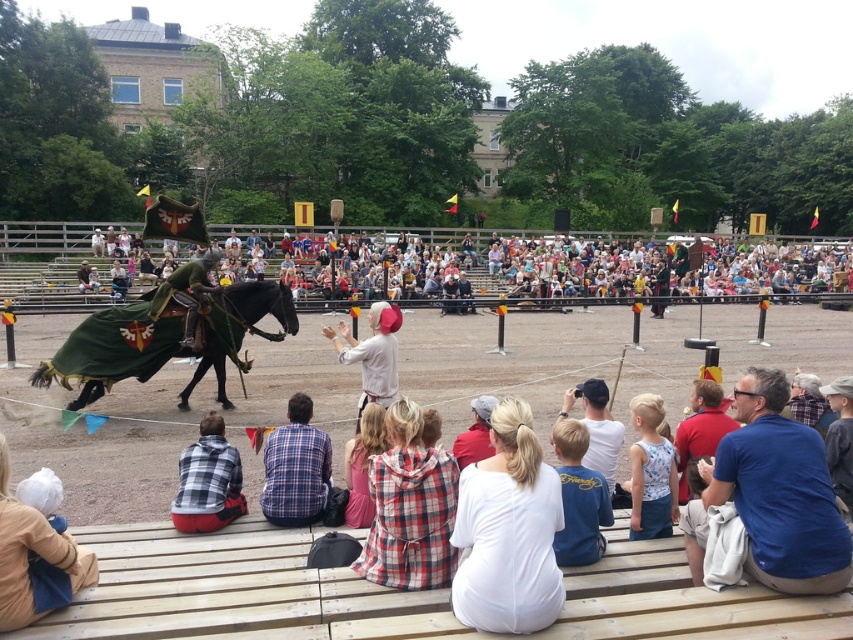
Question: Which of the following is the farthest from the observer?

Choices:
 (A) green velvet cape at left
 (B) red cotton shirt at lower right

Answer: (A)

Question: Which of the following is the closest to the observer?

Choices:
 (A) plaid fabric at center
 (B) green velvet cloth at left
 (C) white cotton t-shirt at center
 (D) white fabric at lower left

Answer: (D)

Question: Does white fabric at lower left have a larger size compared to plaid shirt at center?

Choices:
 (A) no
 (B) yes

Answer: (A)

Question: Estimate the real-world distances between objects in this image. Which object is farther from the blue cotton shirt at lower right?

Choices:
 (A) white fabric at lower left
 (B) green velvet cape at left

Answer: (B)

Question: Is multicolored fabric crowd at center above white cotton t-shirt at center?

Choices:
 (A) yes
 (B) no

Answer: (A)

Question: Is white cotton tank top at center in front of plaid fabric shirt at center?

Choices:
 (A) no
 (B) yes

Answer: (B)